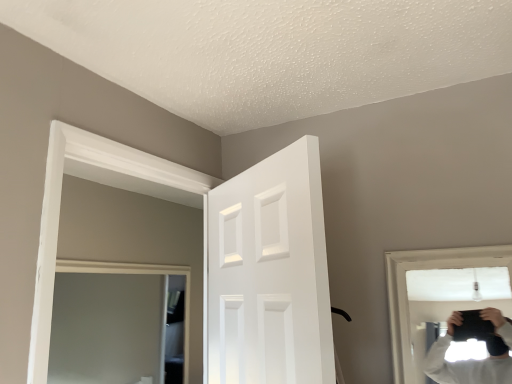
This screenshot has width=512, height=384. I want to click on white painted wood door at center, so click(269, 273).

This screenshot has height=384, width=512. What do you see at coordinates (269, 273) in the screenshot?
I see `white painted wood door at center` at bounding box center [269, 273].

The image size is (512, 384). Identify the location of white painted wood door at center. (269, 273).